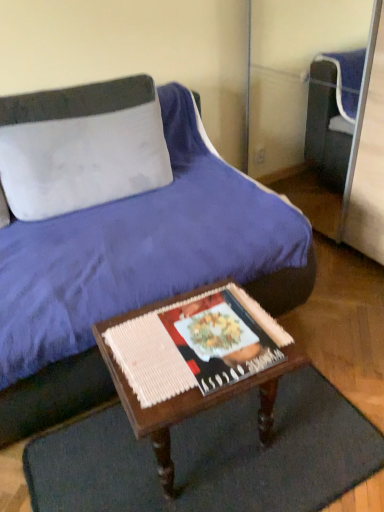
The height and width of the screenshot is (512, 384). I want to click on vacant space to the left of matte paper magazine at center, so click(x=141, y=348).